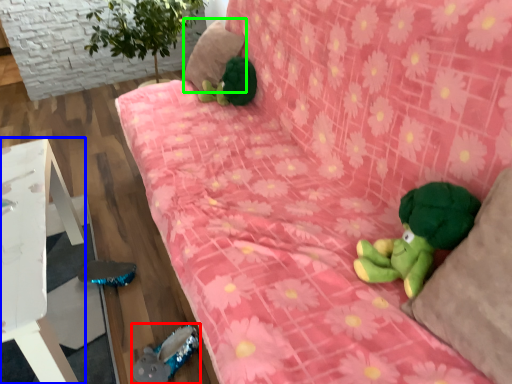
Question: Which object is positioned closest to toy (highlighted by a red box)? Select from furniture (highlighted by a blue box) and pillow (highlighted by a green box).

Choices:
 (A) furniture
 (B) pillow

Answer: (A)